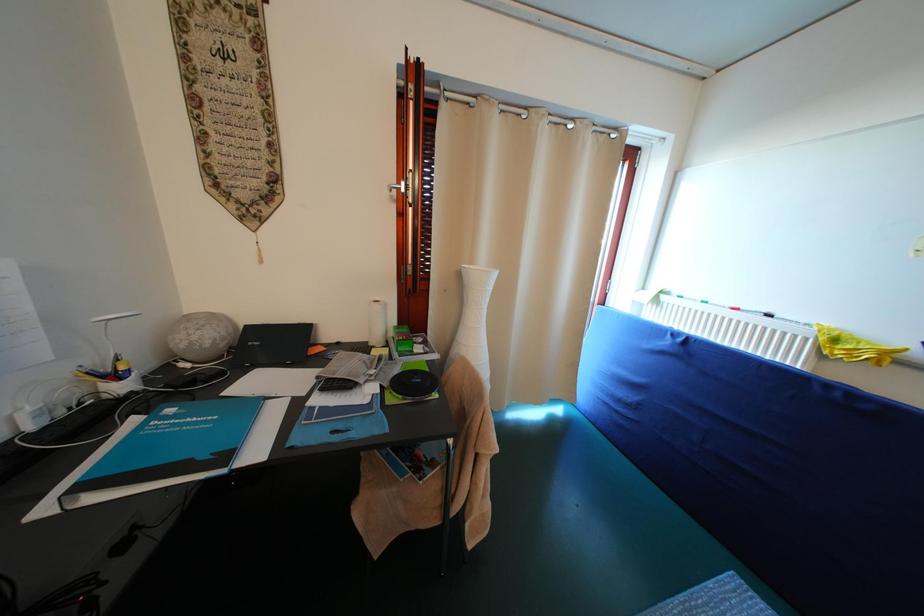
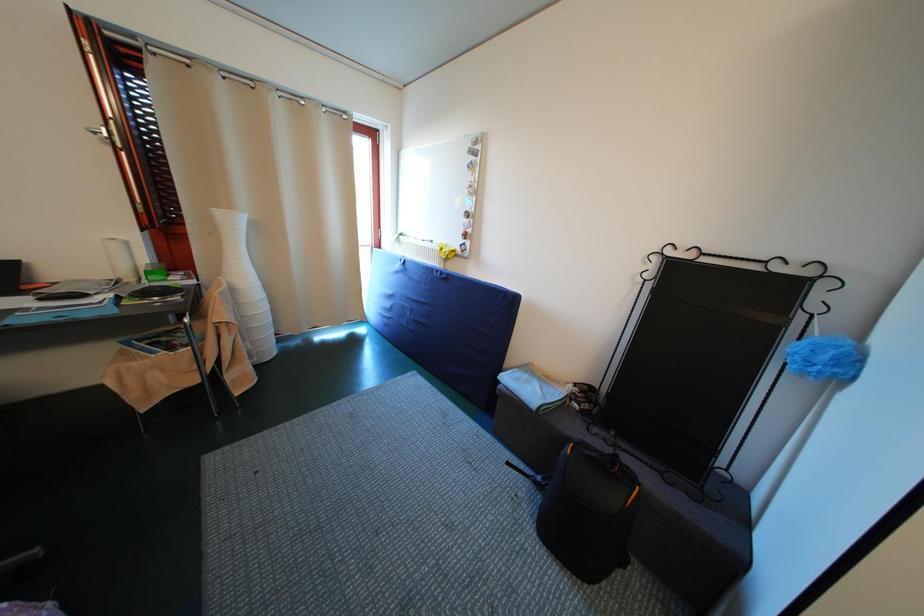
Which direction would the cameraman need to move to produce the second image?

The cameraman moved toward right, backward.